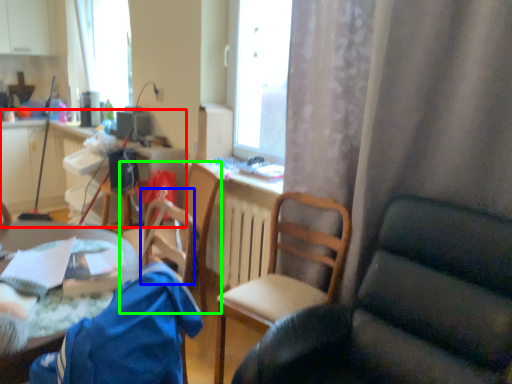
Question: Considering the real-world distances, which object is farthest from computer desk (highlighted by a red box)? armchair (highlighted by a blue box) or chair (highlighted by a green box)?

Choices:
 (A) armchair
 (B) chair

Answer: (A)